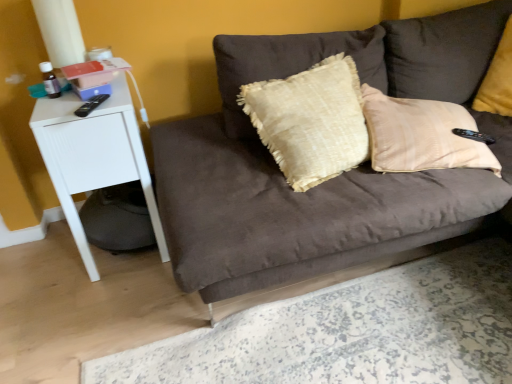
The image size is (512, 384). What are the coordinates of `vacant area that is in front of white matte side table at left` in the screenshot? It's located at (97, 309).